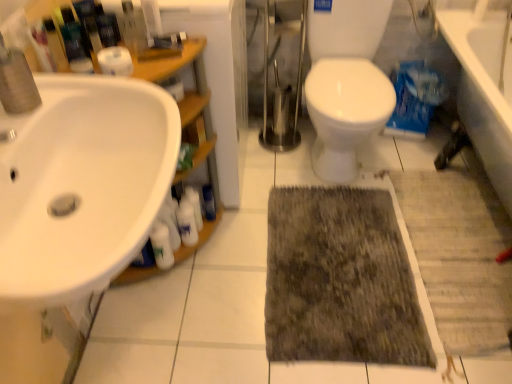
Locate an element on the screen. This screenshot has width=512, height=384. free space that is to the left of white glossy bottle at lower left, which is the first cleaning product from left to right is located at coordinates (131, 286).